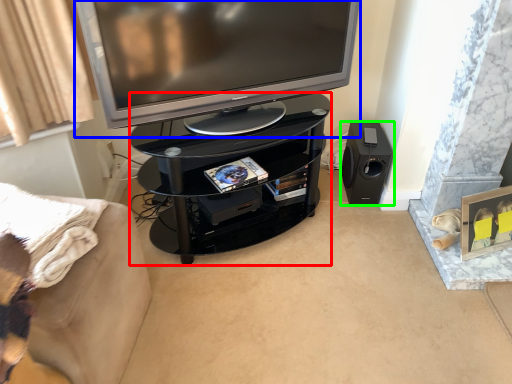
Question: Considering the real-world distances, which object is farthest from tv cabinet (highlighted by a red box)? television (highlighted by a blue box) or loudspeaker (highlighted by a green box)?

Choices:
 (A) television
 (B) loudspeaker

Answer: (B)